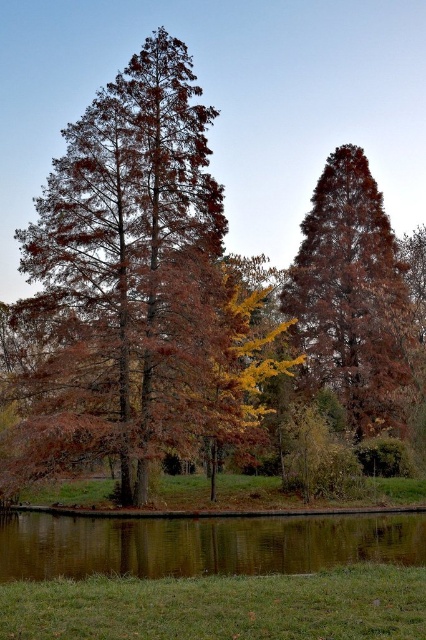
You are standing at the edge of the water in the autumn scene. You see a point marked at coordinates (353,296). Which object does this point correspond to?

The point at coordinates (353,296) corresponds to the matte brown tree at center.